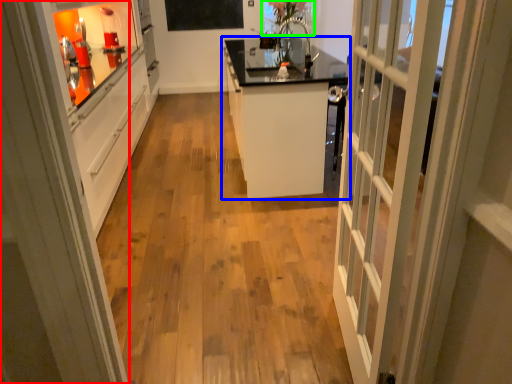
Question: Which is farther away from door (highlighted by a red box)? cabinetry (highlighted by a blue box) or window screen (highlighted by a green box)?

Choices:
 (A) cabinetry
 (B) window screen

Answer: (B)